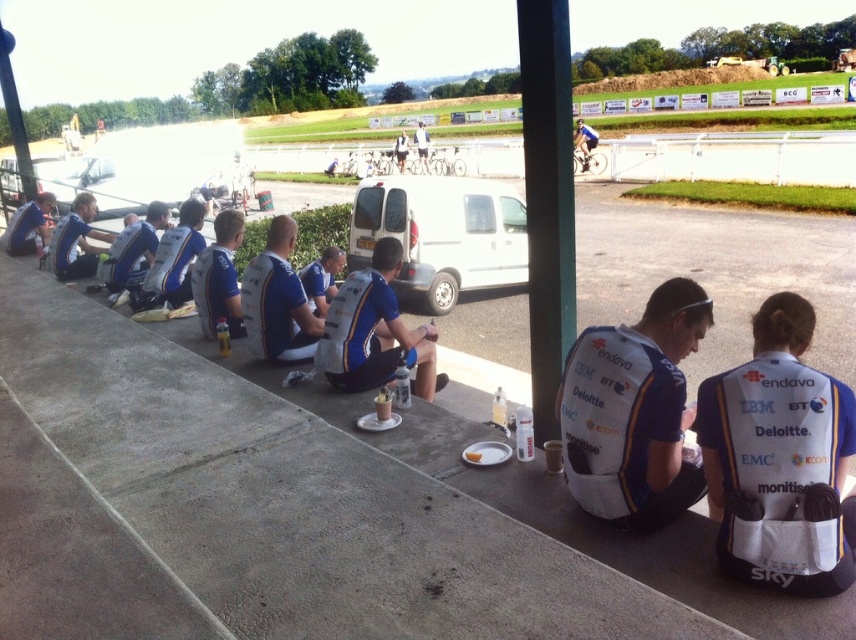
Which is more to the right, white fabric backpack at lower right or white fabric jacket at center?

white fabric backpack at lower right

Does white fabric backpack at lower right have a lesser width compared to white fabric jacket at center?

Yes.

Which is in front, point (716, 465) or point (396, 148)?

Point (716, 465) is more forward.

Locate an element on the screen. white fabric backpack at lower right is located at coordinates (780, 456).

Can you confirm if blue jersey at center is positioned to the right of white fabric jacket at center?

Indeed, blue jersey at center is positioned on the right side of white fabric jacket at center.

This screenshot has height=640, width=856. I want to click on blue jersey at center, so click(x=278, y=300).

Identify the location of blue jersey at center. (278, 300).

I want to click on blue jersey at center, so click(278, 300).

Is white fabric jersey at center below white fabric jacket at center?

Yes.

Which of these two, white fabric jersey at center or white fabric jacket at center, stands shorter?

Standing shorter between the two is white fabric jersey at center.

Is point (632, 392) positioned after point (396, 150)?

No, it is in front of (396, 150).

Locate an element on the screen. This screenshot has width=856, height=640. white fabric jersey at center is located at coordinates (633, 412).